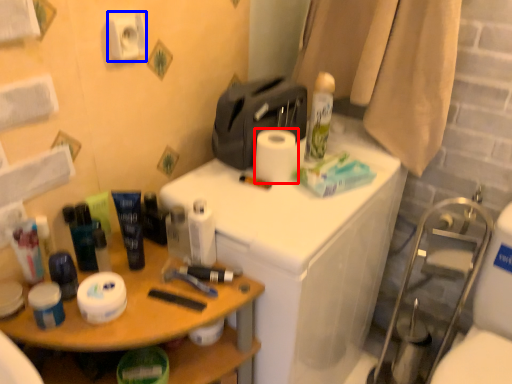
Question: Which of the following is the farthest to the observer, toilet paper (highlighted by a red box) or toilet paper (highlighted by a blue box)?

Choices:
 (A) toilet paper
 (B) toilet paper

Answer: (A)